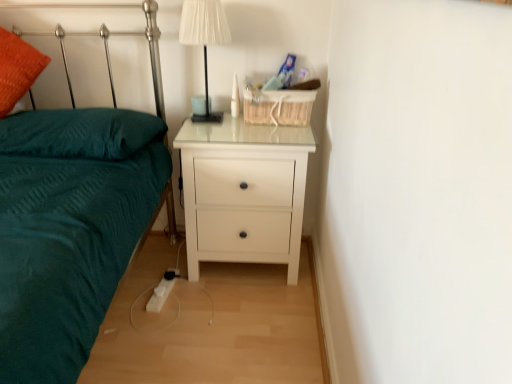
Question: Is white glossy nightstand at center thinner than white fabric lampshade at upper center?

Choices:
 (A) no
 (B) yes

Answer: (A)

Question: Is white glossy nightstand at center to the right of white fabric lampshade at upper center from the viewer's perspective?

Choices:
 (A) yes
 (B) no

Answer: (A)

Question: Is white glossy nightstand at center next to white fabric lampshade at upper center?

Choices:
 (A) yes
 (B) no

Answer: (B)

Question: Is white glossy nightstand at center to the left of white fabric lampshade at upper center from the viewer's perspective?

Choices:
 (A) yes
 (B) no

Answer: (B)

Question: Are white glossy nightstand at center and white fabric lampshade at upper center located far from each other?

Choices:
 (A) yes
 (B) no

Answer: (B)

Question: Is white fabric lampshade at upper center taller or shorter than white glossy nightstand at center?

Choices:
 (A) short
 (B) tall

Answer: (A)

Question: Do you think white fabric lampshade at upper center is within white glossy nightstand at center, or outside of it?

Choices:
 (A) outside
 (B) inside

Answer: (A)

Question: From the image's perspective, is white fabric lampshade at upper center located above or below white glossy nightstand at center?

Choices:
 (A) above
 (B) below

Answer: (A)

Question: Is white fabric lampshade at upper center to the left or to the right of white glossy nightstand at center in the image?

Choices:
 (A) right
 (B) left

Answer: (B)

Question: Is point (195, 135) closer or farther from the camera than point (186, 8)?

Choices:
 (A) farther
 (B) closer

Answer: (A)

Question: Is white glossy nightstand at center bigger or smaller than white fabric lampshade at upper center?

Choices:
 (A) small
 (B) big

Answer: (B)

Question: Is white glossy nightstand at center in front of or behind white fabric lampshade at upper center in the image?

Choices:
 (A) behind
 (B) front

Answer: (A)

Question: Is white glossy nightstand at center situated inside white fabric lampshade at upper center or outside?

Choices:
 (A) inside
 (B) outside

Answer: (B)

Question: From the image's perspective, is teal soft pillow at left positioned above or below white fabric lampshade at upper center?

Choices:
 (A) above
 (B) below

Answer: (B)

Question: Based on their sizes in the image, would you say teal soft pillow at left is bigger or smaller than white fabric lampshade at upper center?

Choices:
 (A) small
 (B) big

Answer: (B)